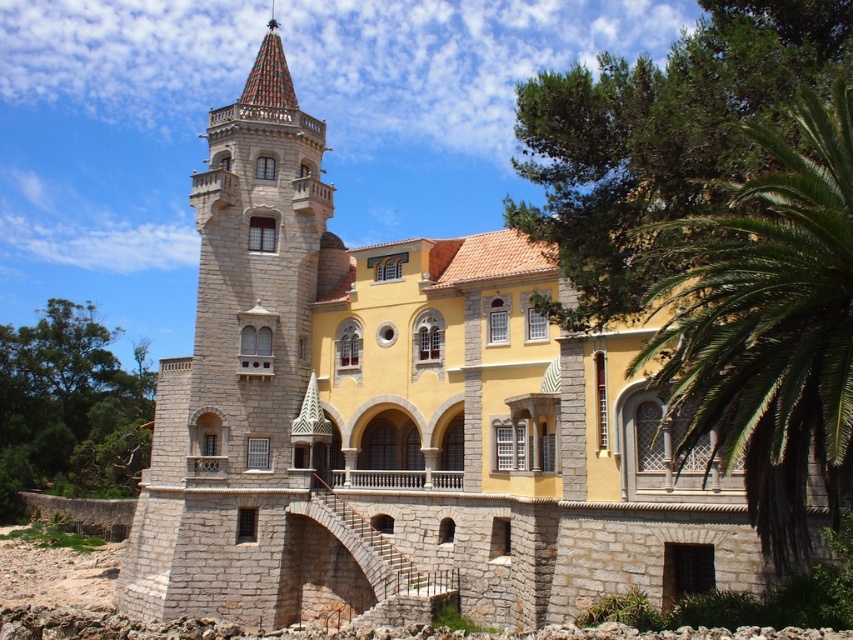
Between stone tower at center and green leafy palm at right, which one has more height?

With more height is stone tower at center.

Which is more to the left, stone tower at center or green leafy palm at right?

From the viewer's perspective, stone tower at center appears more on the left side.

I want to click on stone tower at center, so click(242, 378).